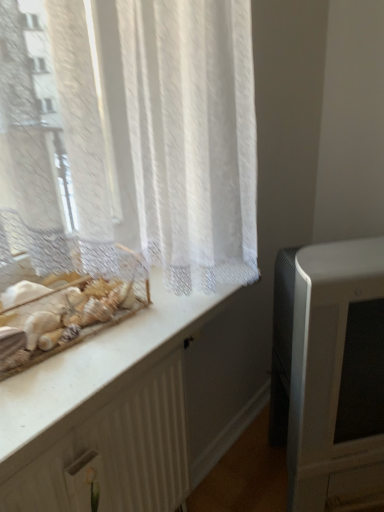
Question: Is white textured radiator at lower left aimed at matte white television at right?

Choices:
 (A) yes
 (B) no

Answer: (B)

Question: Is matte white television at right completely or partially inside white textured radiator at lower left?

Choices:
 (A) yes
 (B) no

Answer: (B)

Question: Can you see white textured radiator at lower left touching matte white television at right?

Choices:
 (A) no
 (B) yes

Answer: (A)

Question: Considering the relative positions of white textured radiator at lower left and matte white television at right in the image provided, is white textured radiator at lower left behind matte white television at right?

Choices:
 (A) no
 (B) yes

Answer: (A)

Question: Does white textured radiator at lower left appear on the left side of matte white television at right?

Choices:
 (A) yes
 (B) no

Answer: (A)

Question: Based on their sizes in the image, would you say white marble counter at upper left is bigger or smaller than white textured radiator at lower left?

Choices:
 (A) small
 (B) big

Answer: (A)

Question: In terms of width, does white marble counter at upper left look wider or thinner when compared to white textured radiator at lower left?

Choices:
 (A) thin
 (B) wide

Answer: (B)

Question: In the image, is white marble counter at upper left on the left side or the right side of white textured radiator at lower left?

Choices:
 (A) right
 (B) left

Answer: (B)

Question: From the image's perspective, relative to white textured radiator at lower left, is white marble counter at upper left above or below?

Choices:
 (A) below
 (B) above

Answer: (B)

Question: From a real-world perspective, is white marble counter at upper left physically located above or below matte white television at right?

Choices:
 (A) above
 (B) below

Answer: (A)

Question: In terms of height, does white marble counter at upper left look taller or shorter compared to matte white television at right?

Choices:
 (A) tall
 (B) short

Answer: (B)

Question: Would you say white marble counter at upper left is inside or outside matte white television at right?

Choices:
 (A) inside
 (B) outside

Answer: (B)

Question: In the image, is white marble counter at upper left positioned in front of or behind matte white television at right?

Choices:
 (A) front
 (B) behind

Answer: (A)

Question: Is white textured radiator at lower left wider or thinner than matte white television at right?

Choices:
 (A) wide
 (B) thin

Answer: (B)

Question: Is white textured radiator at lower left bigger or smaller than matte white television at right?

Choices:
 (A) big
 (B) small

Answer: (B)